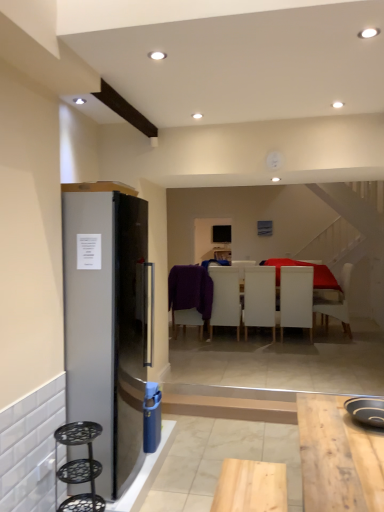
Question: Is white matte chair at center, the fifth chair positioned from the left, positioned in front of white matte chair at center, which is the third chair from left to right?

Choices:
 (A) no
 (B) yes

Answer: (A)

Question: Does white matte chair at center, which is counted as the 1th chair, starting from the right, appear on the left side of white matte chair at center, the third chair viewed from the right?

Choices:
 (A) no
 (B) yes

Answer: (A)

Question: Could you tell me if white matte chair at center, which is counted as the 1th chair, starting from the right, is facing white matte chair at center, which is the third chair from left to right?

Choices:
 (A) no
 (B) yes

Answer: (A)

Question: Is white matte chair at center, which is counted as the 1th chair, starting from the right, smaller than white matte chair at center, which is the third chair from left to right?

Choices:
 (A) no
 (B) yes

Answer: (A)

Question: Is white matte chair at center, the fifth chair positioned from the left, further to the viewer compared to white matte chair at center, which is the third chair from left to right?

Choices:
 (A) no
 (B) yes

Answer: (B)

Question: From the image's perspective, is black non-stick pan at lower right located above or below white matte chair at center, the third chair viewed from the right?

Choices:
 (A) below
 (B) above

Answer: (A)

Question: Considering the relative positions of black non-stick pan at lower right and white matte chair at center, the third chair viewed from the right, in the image provided, is black non-stick pan at lower right to the left or to the right of white matte chair at center, the third chair viewed from the right,?

Choices:
 (A) right
 (B) left

Answer: (B)

Question: Looking at their shapes, would you say black non-stick pan at lower right is wider or thinner than white matte chair at center, the third chair viewed from the right?

Choices:
 (A) thin
 (B) wide

Answer: (A)

Question: Looking at the image, does black non-stick pan at lower right seem bigger or smaller compared to white matte chair at center, the third chair viewed from the right?

Choices:
 (A) big
 (B) small

Answer: (B)

Question: Considering their positions, is satin silver refrigerator at left located in front of or behind black metal bar stool at left?

Choices:
 (A) behind
 (B) front

Answer: (A)

Question: Based on their positions, is satin silver refrigerator at left located to the left or right of black metal bar stool at left?

Choices:
 (A) right
 (B) left

Answer: (B)

Question: From the image's perspective, is satin silver refrigerator at left located above or below black metal bar stool at left?

Choices:
 (A) above
 (B) below

Answer: (A)

Question: From a real-world perspective, is satin silver refrigerator at left positioned above or below black metal bar stool at left?

Choices:
 (A) below
 (B) above

Answer: (B)

Question: In terms of size, does purple fabric chair at center, which ranks as the 5th chair in right-to-left order, appear bigger or smaller than white matte chair at center, which is counted as the 1th chair, starting from the right?

Choices:
 (A) small
 (B) big

Answer: (A)

Question: Considering their positions, is purple fabric chair at center, which is the first chair in left-to-right order, located in front of or behind white matte chair at center, the fifth chair positioned from the left?

Choices:
 (A) front
 (B) behind

Answer: (A)